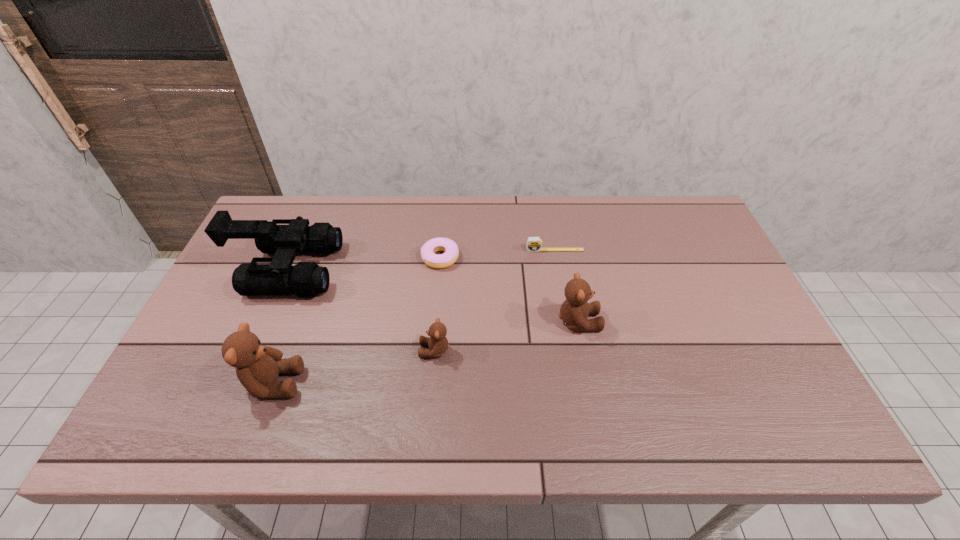
Locate an element on the screen. the leftmost teddy bear is located at coordinates [x=257, y=367].

At what (x,y) coordinates should I click in order to perform the action: click on the second teddy bear from right to left. Please return your answer as a coordinate pair (x, y). Image resolution: width=960 pixels, height=540 pixels. Looking at the image, I should click on (438, 344).

What are the coordinates of `the third shortest object` in the screenshot? It's located at (438, 344).

Where is `the rightmost teddy bear`? This screenshot has height=540, width=960. the rightmost teddy bear is located at coordinates (574, 311).

You are a GUI agent. You are given a task and a screenshot of the screen. Output one action in this format:
    pyautogui.click(x=<x>, y=<y>)
    Task: Click on the fourth shortest object
    The width and height of the screenshot is (960, 540).
    Given the screenshot: What is the action you would take?
    pyautogui.click(x=574, y=311)

Where is `binoculars`? The image size is (960, 540). binoculars is located at coordinates (306, 279).

At what (x,y) coordinates should I click in order to perform the action: click on tape measure. Please return your answer as a coordinate pair (x, y). Looking at the image, I should click on (534, 244).

Locate an element on the screen. Image resolution: width=960 pixels, height=540 pixels. doughnut is located at coordinates (428, 250).

Where is `free space located on the face of the leftmost teddy bear`? Image resolution: width=960 pixels, height=540 pixels. free space located on the face of the leftmost teddy bear is located at coordinates (340, 383).

At what (x,y) coordinates should I click in order to perform the action: click on free space located on the face of the second teddy bear from right to left. Please return your answer as a coordinate pair (x, y). The width and height of the screenshot is (960, 540). Looking at the image, I should click on (291, 350).